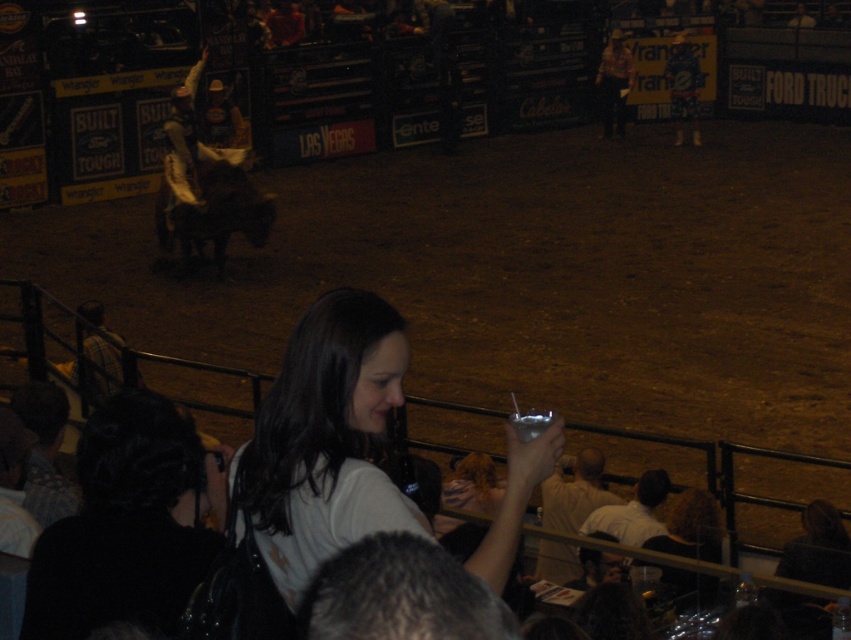
You are a photographer positioned at the center of the arena. You want to capture a closeup shot of the black fabric hair at lower left. Based on its coordinates, is it within your camera frame that covers the area from point 0.7 to 0.95 on the x and y axes?

The black fabric hair at lower left is located at point (126, 525). Since the camera frame covers from 0.7 to 0.95 on both axes, the x coordinate 0.822 falls within the range, but the y coordinate 0.149 is below the minimum y value of 0.7. Therefore, it is not within the camera frame.

From the picture: You are a photographer standing in the audience at the rodeo. You want to take a photo of the black fabric hair at lower left and the dark brown leather horse at center in the same frame. Given that your camera has a maximum focal length that allows capturing objects up to 10 meters apart in the same shot, will you be able to include both in the photo?

The black fabric hair at lower left and dark brown leather horse at center are 9.29 meters apart, so yes, the camera can capture both in the same frame since the distance is within the 10 meters limit.